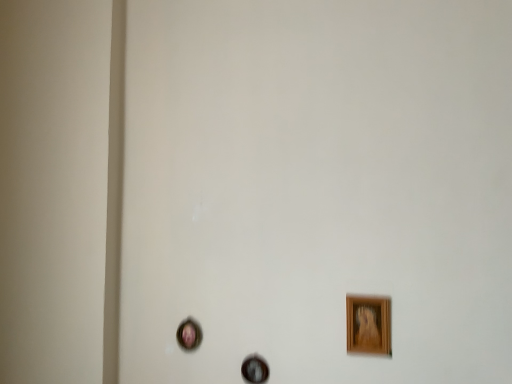
Question: Is wooden picture frame at lower right, positioned as the 3th picture frame in left-to-right order, positioned far away from wooden picture frame at center, which is the 2th picture frame in back-to-front order?

Choices:
 (A) no
 (B) yes

Answer: (A)

Question: Could you tell me if wooden picture frame at lower right, positioned as the 3th picture frame in left-to-right order, is facing wooden picture frame at center, the second picture frame in the right-to-left sequence?

Choices:
 (A) no
 (B) yes

Answer: (A)

Question: From the image's perspective, is wooden picture frame at lower right, which is counted as the first picture frame, starting from the right, located beneath wooden picture frame at center, the 2th picture frame from the front?

Choices:
 (A) no
 (B) yes

Answer: (A)

Question: Are wooden picture frame at lower right, positioned as the 3th picture frame in left-to-right order, and wooden picture frame at center, which is counted as the 2th picture frame, starting from the left, making contact?

Choices:
 (A) yes
 (B) no

Answer: (B)

Question: Is the depth of wooden picture frame at lower right, placed as the 1th picture frame when sorted from front to back, less than that of wooden picture frame at center, which is the 2th picture frame in back-to-front order?

Choices:
 (A) yes
 (B) no

Answer: (A)

Question: Considering the positions of point (347, 340) and point (180, 344), is point (347, 340) closer or farther from the camera than point (180, 344)?

Choices:
 (A) farther
 (B) closer

Answer: (B)

Question: Do you think wooden picture frame at lower right, positioned as the 3th picture frame in left-to-right order, is within matte pink picture frame at lower left, which is counted as the first picture frame, starting from the back, or outside of it?

Choices:
 (A) inside
 (B) outside

Answer: (B)

Question: From the image's perspective, is wooden picture frame at lower right, the third picture frame in the back-to-front sequence, positioned above or below matte pink picture frame at lower left, positioned as the third picture frame in front-to-back order?

Choices:
 (A) below
 (B) above

Answer: (B)

Question: Considering the relative positions of wooden picture frame at lower right, placed as the 1th picture frame when sorted from front to back, and matte pink picture frame at lower left, the first picture frame when ordered from left to right, in the image provided, is wooden picture frame at lower right, placed as the 1th picture frame when sorted from front to back, to the left or to the right of matte pink picture frame at lower left, the first picture frame when ordered from left to right,?

Choices:
 (A) right
 (B) left

Answer: (A)

Question: From the image's perspective, is matte pink picture frame at lower left, which is counted as the first picture frame, starting from the back, positioned above or below wooden picture frame at lower right, positioned as the 3th picture frame in left-to-right order?

Choices:
 (A) below
 (B) above

Answer: (A)

Question: From a real-world perspective, relative to wooden picture frame at lower right, placed as the 1th picture frame when sorted from front to back, is matte pink picture frame at lower left, the 3th picture frame positioned from the right, vertically above or below?

Choices:
 (A) above
 (B) below

Answer: (B)

Question: Considering their positions, is matte pink picture frame at lower left, positioned as the third picture frame in front-to-back order, located in front of or behind wooden picture frame at lower right, which is counted as the first picture frame, starting from the right?

Choices:
 (A) behind
 (B) front

Answer: (A)

Question: Is point (194, 332) closer or farther from the camera than point (361, 314)?

Choices:
 (A) closer
 (B) farther

Answer: (B)

Question: From their relative heights in the image, would you say wooden picture frame at center, the second picture frame in the right-to-left sequence, is taller or shorter than wooden picture frame at lower right, placed as the 1th picture frame when sorted from front to back?

Choices:
 (A) tall
 (B) short

Answer: (B)

Question: Is wooden picture frame at center, the second picture frame in the right-to-left sequence, spatially inside wooden picture frame at lower right, placed as the 1th picture frame when sorted from front to back, or outside of it?

Choices:
 (A) outside
 (B) inside

Answer: (A)